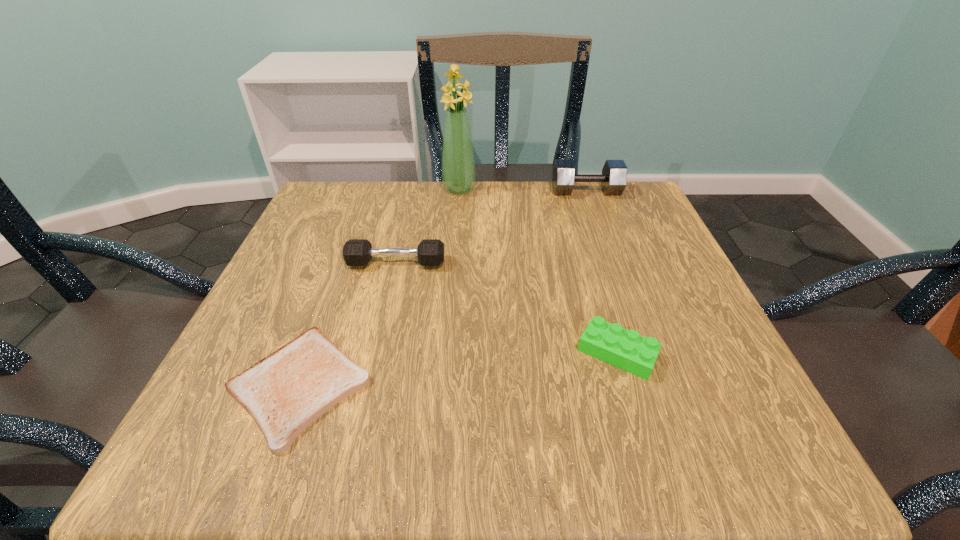
Where is `the tallest object`? Image resolution: width=960 pixels, height=540 pixels. the tallest object is located at coordinates (458, 165).

Locate an element on the screen. the farther dumbbell is located at coordinates (613, 179).

Where is `the taller dumbbell`? the taller dumbbell is located at coordinates (613, 179).

Image resolution: width=960 pixels, height=540 pixels. I want to click on the shorter dumbbell, so click(356, 252).

The image size is (960, 540). In order to click on the left dumbbell in this screenshot , I will do `click(356, 252)`.

This screenshot has width=960, height=540. What are the coordinates of `the fourth tallest object` in the screenshot? It's located at (625, 349).

Where is `toast`? Image resolution: width=960 pixels, height=540 pixels. toast is located at coordinates (285, 392).

Find the location of a particular element. Image resolution: width=960 pixels, height=540 pixels. free space located 0.230m on the front-facing side of the bouquet is located at coordinates (454, 259).

Image resolution: width=960 pixels, height=540 pixels. I want to click on blank area located 0.310m on the left of the right dumbbell, so click(x=425, y=191).

The image size is (960, 540). What are the coordinates of `free space located 0.140m on the front of the third shortest object` in the screenshot? It's located at (382, 325).